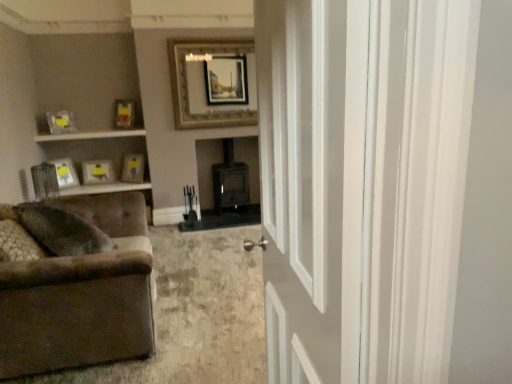
Question: Is brown fabric couch at lower left taller or shorter than matte silver picture frame at left, the 6th picture frame when ordered from right to left?

Choices:
 (A) tall
 (B) short

Answer: (A)

Question: In the image, is brown fabric couch at lower left positioned in front of or behind matte silver picture frame at left, the first picture frame viewed from the left?

Choices:
 (A) front
 (B) behind

Answer: (A)

Question: Considering the real-world distances, which object is farthest from the matte yellow picture frame at center, marked as the fifth picture frame in a left-to-right arrangement?

Choices:
 (A) matte yellow picture frame at upper left, which is counted as the third picture frame, starting from the right
 (B) matte yellow picture frame at upper left, the 5th picture frame viewed from the right
 (C) brown fabric couch at lower left
 (D) white glossy door at center
 (E) matte silver picture frame at left, the 6th picture frame when ordered from right to left

Answer: (D)

Question: Which is farther from the matte yellow picture frame at upper left, which is counted as the third picture frame, starting from the right?

Choices:
 (A) gold metallic picture frame at upper center, which ranks as the first picture frame in right-to-left order
 (B) matte yellow picture frame at upper left, the 5th picture frame viewed from the right
 (C) matte yellow picture frame at center, which is the 2th picture frame in right-to-left order
 (D) matte silver picture frame at left, the first picture frame viewed from the left
 (E) matte yellow picture frame at upper left, the third picture frame from the left

Answer: (A)